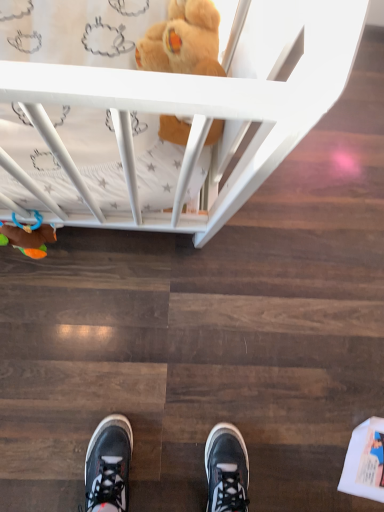
Question: In which direction should I rotate to look at soft plush bear at upper center, which is the first toy from top to bottom?

Choices:
 (A) left
 (B) right

Answer: (A)

Question: Is soft plush toy at lower left, marked as the 2th toy in a top-to-bottom arrangement, positioned in front of soft plush bear at upper center, the second toy viewed from the left?

Choices:
 (A) no
 (B) yes

Answer: (A)

Question: From the image's perspective, would you say soft plush toy at lower left, acting as the 1th toy starting from the left, is positioned over soft plush bear at upper center, the second toy viewed from the left?

Choices:
 (A) no
 (B) yes

Answer: (A)

Question: From the image's perspective, would you say soft plush toy at lower left, marked as the 2th toy in a top-to-bottom arrangement, is shown under soft plush bear at upper center, which is the first toy from top to bottom?

Choices:
 (A) no
 (B) yes

Answer: (B)

Question: From a real-world perspective, is soft plush toy at lower left, placed as the first toy when sorted from bottom to top, physically below soft plush bear at upper center, the second toy when ordered from bottom to top?

Choices:
 (A) no
 (B) yes

Answer: (B)

Question: Is soft plush toy at lower left, placed as the first toy when sorted from bottom to top, looking in the opposite direction of soft plush bear at upper center, the second toy when ordered from bottom to top?

Choices:
 (A) no
 (B) yes

Answer: (A)

Question: Is soft plush toy at lower left, acting as the 1th toy starting from the left, positioned behind soft plush bear at upper center, the second toy viewed from the left?

Choices:
 (A) no
 (B) yes

Answer: (B)

Question: Considering the relative positions of soft plush bear at upper center, the second toy viewed from the left, and soft plush toy at lower left, marked as the 2th toy in a top-to-bottom arrangement, in the image provided, is soft plush bear at upper center, the second toy viewed from the left, to the left of soft plush toy at lower left, marked as the 2th toy in a top-to-bottom arrangement, from the viewer's perspective?

Choices:
 (A) yes
 (B) no

Answer: (B)

Question: Can you confirm if soft plush bear at upper center, the second toy when ordered from bottom to top, is bigger than soft plush toy at lower left, acting as the 1th toy starting from the left?

Choices:
 (A) no
 (B) yes

Answer: (B)

Question: Is soft plush bear at upper center, which is the first toy from top to bottom, turned away from soft plush toy at lower left, placed as the first toy when sorted from bottom to top?

Choices:
 (A) no
 (B) yes

Answer: (A)

Question: From a real-world perspective, is soft plush bear at upper center, which is the first toy from right to left, positioned over soft plush toy at lower left, acting as the 1th toy starting from the left, based on gravity?

Choices:
 (A) no
 (B) yes

Answer: (B)

Question: Can you confirm if soft plush bear at upper center, which is the first toy from right to left, is smaller than soft plush toy at lower left, acting as the 1th toy starting from the left?

Choices:
 (A) yes
 (B) no

Answer: (B)

Question: Is soft plush bear at upper center, which is the first toy from right to left, oriented towards soft plush toy at lower left, marked as the 2th toy in a top-to-bottom arrangement?

Choices:
 (A) yes
 (B) no

Answer: (B)

Question: Relative to soft plush bear at upper center, which is the first toy from top to bottom, is soft plush toy at lower left, placed as the first toy when sorted from bottom to top, in front or behind?

Choices:
 (A) front
 (B) behind

Answer: (B)